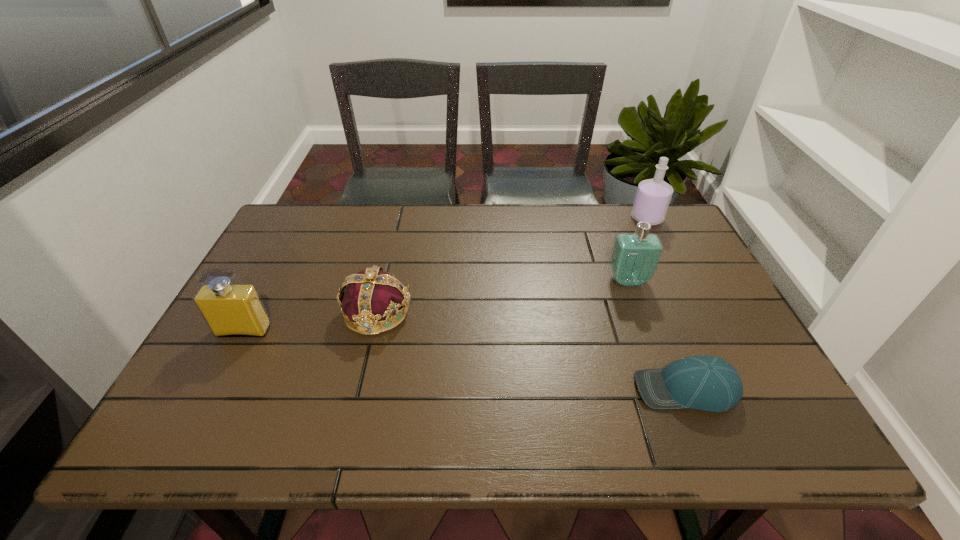
Where is `free point between the baseball cap and the leftmost object`? The height and width of the screenshot is (540, 960). free point between the baseball cap and the leftmost object is located at coordinates (465, 360).

Find the location of a particular element. The image size is (960, 540). empty location between the shortest object and the second shortest object is located at coordinates [x=531, y=351].

The width and height of the screenshot is (960, 540). I want to click on empty space between the second object from left to right and the second perfume from right to left, so click(x=502, y=296).

In order to click on empty space that is in between the second nearest perfume and the baseball cap in this screenshot , I will do `click(657, 335)`.

I want to click on object that is the second nearest to the crown, so [x=707, y=383].

Choose which object is the third nearest neighbor to the rightmost perfume. Please provide its 2D coordinates. Your answer should be formatted as a tuple, i.e. [(x, y)], where the tuple contains the x and y coordinates of a point satisfying the conditions above.

[(372, 295)]

Where is `perfume that stands as the closest to the leftmost object`? This screenshot has height=540, width=960. perfume that stands as the closest to the leftmost object is located at coordinates (634, 259).

Identify which perfume is the nearest to the second perfume from left to right. Please provide its 2D coordinates. Your answer should be formatted as a tuple, i.e. [(x, y)], where the tuple contains the x and y coordinates of a point satisfying the conditions above.

[(653, 196)]

You are a GUI agent. You are given a task and a screenshot of the screen. Output one action in this format:
    pyautogui.click(x=<x>, y=<y>)
    Task: Click on the free space that satisfies the following two spatial constraints: 1. on the back side of the farthest perfume; 2. on the right side of the baseball cap
    
    Given the screenshot: What is the action you would take?
    point(616,218)

I want to click on free space that satisfies the following two spatial constraints: 1. on the front label of the nearest object; 2. on the left side of the second nearest perfume, so click(x=668, y=390).